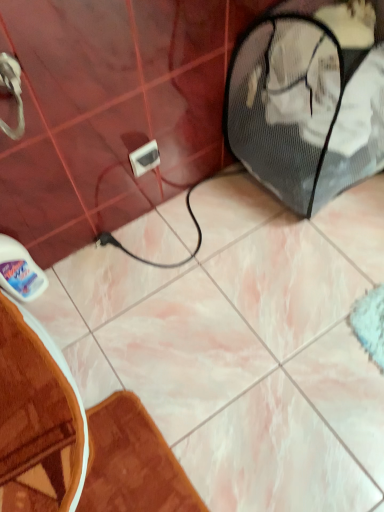
Question: Which is correct: white plastic outlet at center is inside brown textured bath mat at lower left, or outside of it?

Choices:
 (A) inside
 (B) outside

Answer: (B)

Question: Is white plastic outlet at center in front of or behind brown textured bath mat at lower left in the image?

Choices:
 (A) front
 (B) behind

Answer: (B)

Question: Based on their positions, is white plastic outlet at center located to the left or right of brown textured bath mat at lower left?

Choices:
 (A) left
 (B) right

Answer: (B)

Question: From a real-world perspective, is brown textured bath mat at lower left above or below white plastic outlet at center?

Choices:
 (A) above
 (B) below

Answer: (B)

Question: Visually, is brown textured bath mat at lower left positioned to the left or to the right of white plastic outlet at center?

Choices:
 (A) right
 (B) left

Answer: (B)

Question: Considering the positions of brown textured bath mat at lower left and white plastic outlet at center in the image, is brown textured bath mat at lower left bigger or smaller than white plastic outlet at center?

Choices:
 (A) small
 (B) big

Answer: (B)

Question: From the image's perspective, is brown textured bath mat at lower left located above or below white plastic outlet at center?

Choices:
 (A) above
 (B) below

Answer: (B)